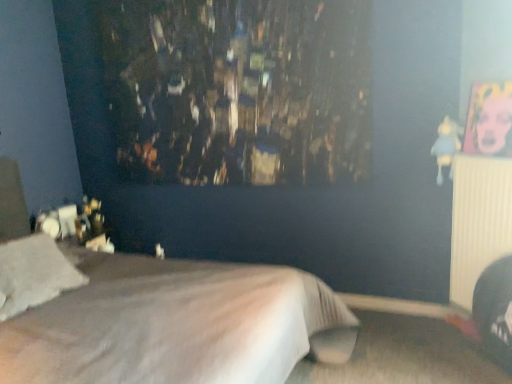
Question: Is white soft bed at center taller than white ribbed radiator at right?

Choices:
 (A) no
 (B) yes

Answer: (B)

Question: Is the position of white soft bed at center more distant than that of white ribbed radiator at right?

Choices:
 (A) yes
 (B) no

Answer: (B)

Question: Is white soft bed at center placed right next to white ribbed radiator at right?

Choices:
 (A) no
 (B) yes

Answer: (A)

Question: Considering the relative sizes of white soft bed at center and white ribbed radiator at right in the image provided, is white soft bed at center bigger than white ribbed radiator at right?

Choices:
 (A) yes
 (B) no

Answer: (A)

Question: Can you confirm if white soft bed at center is shorter than white ribbed radiator at right?

Choices:
 (A) no
 (B) yes

Answer: (A)

Question: Could white ribbed radiator at right be considered to be inside white soft bed at center?

Choices:
 (A) no
 (B) yes

Answer: (A)

Question: Can you confirm if white soft pillow at lower left is wider than blue fabric doll at upper right?

Choices:
 (A) yes
 (B) no

Answer: (A)

Question: Does white soft pillow at lower left come behind blue fabric doll at upper right?

Choices:
 (A) no
 (B) yes

Answer: (A)

Question: Is white soft pillow at lower left surrounding blue fabric doll at upper right?

Choices:
 (A) yes
 (B) no

Answer: (B)

Question: Is the position of white soft pillow at lower left less distant than that of blue fabric doll at upper right?

Choices:
 (A) no
 (B) yes

Answer: (B)

Question: Does white soft pillow at lower left appear on the right side of blue fabric doll at upper right?

Choices:
 (A) no
 (B) yes

Answer: (A)

Question: Is white soft pillow at lower left directly adjacent to blue fabric doll at upper right?

Choices:
 (A) yes
 (B) no

Answer: (B)

Question: Is the position of blue fabric doll at upper right less distant than that of white soft pillow at lower left?

Choices:
 (A) no
 (B) yes

Answer: (A)